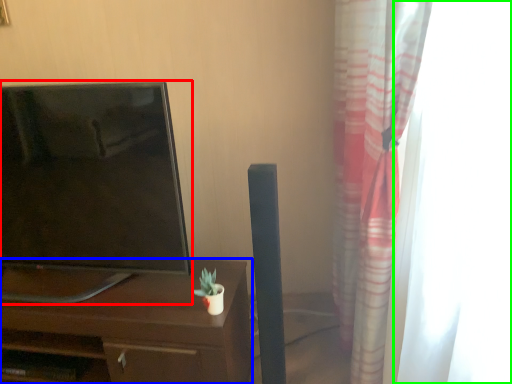
Question: Based on their relative distances, which object is farther from television (highlighted by a red box)? Choose from desk (highlighted by a blue box) and glass door (highlighted by a green box).

Choices:
 (A) desk
 (B) glass door

Answer: (B)